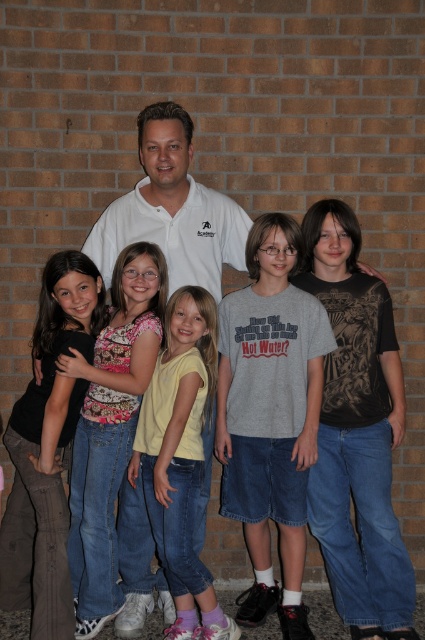
Question: Which is nearer to the matte black shirt at left?

Choices:
 (A) yellow cotton shirt at center
 (B) white cotton shirt at center

Answer: (A)

Question: Is denim jeans at left thinner than yellow cotton shirt at center?

Choices:
 (A) no
 (B) yes

Answer: (B)

Question: Which object is the closest to the matte black shirt at left?

Choices:
 (A) denim jeans at left
 (B) white cotton shirt at center
 (C) yellow cotton shirt at center
 (D) gray cotton t-shirt at center

Answer: (A)

Question: Which point is farther to the camera?

Choices:
 (A) matte black shirt at left
 (B) yellow cotton shirt at center
 (C) gray cotton t-shirt at center
 (D) white cotton shirt at center

Answer: (D)

Question: Is matte black shirt at left positioned before white cotton shirt at center?

Choices:
 (A) yes
 (B) no

Answer: (A)

Question: Can you confirm if matte black shirt at left is smaller than denim jeans at left?

Choices:
 (A) yes
 (B) no

Answer: (A)